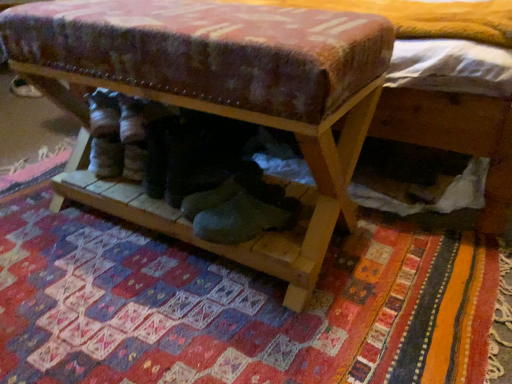
The height and width of the screenshot is (384, 512). I want to click on free location in front of wooden shoe rack at center, so click(x=177, y=318).